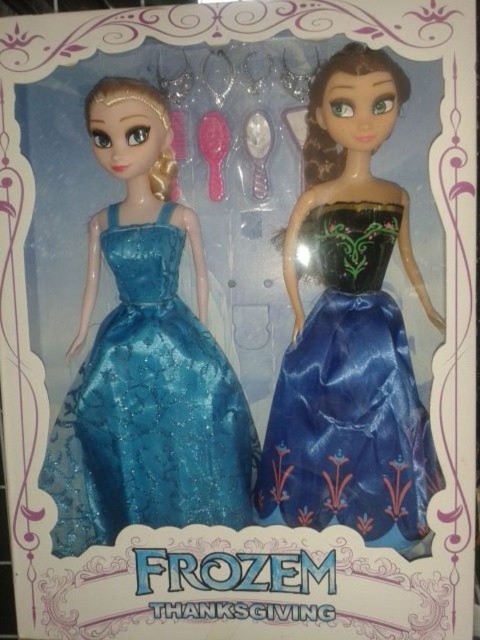
Consider the image. Who is more forward, (x=255, y=448) or (x=384, y=458)?

Point (x=384, y=458) is more forward.

Locate an element on the screen. Image resolution: width=480 pixels, height=640 pixels. shiny blue satin dress at left is located at coordinates (148, 408).

Find the location of a particular element. This screenshot has height=640, width=480. shiny blue satin dress at left is located at coordinates (148, 408).